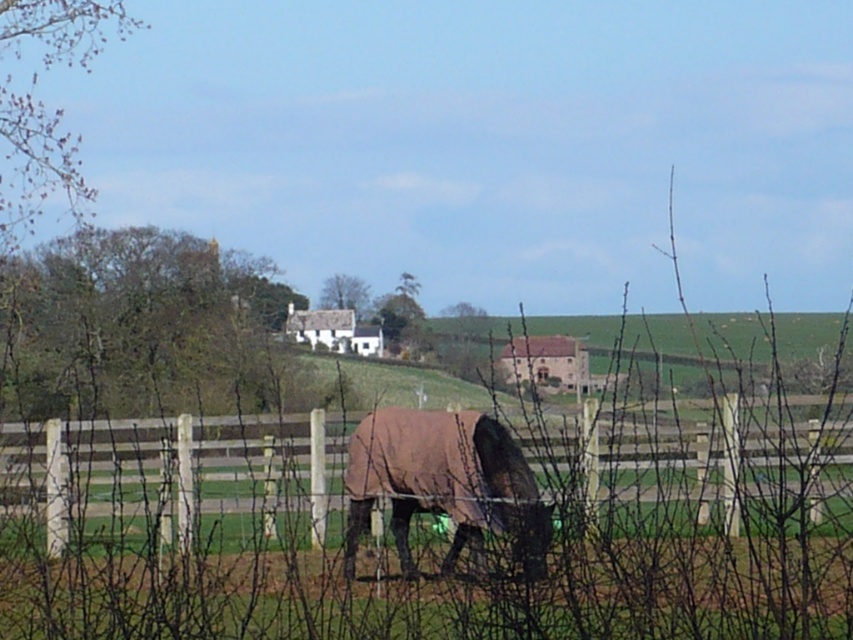
You are standing at the edge of the field looking towards the brown fuzzy horse at center. Which side of the horse do you see the brown wooden fence at lower center located?

The brown wooden fence at lower center is located to the right of the brown fuzzy horse at center from your perspective.

You are standing at the point with coordinates point [538,516] and want to move towards the point with coordinates point [292,417]. Given that the terrain between them is uneven but mostly flat, will you have to climb uphill or go downhill?

Since point [292,417] is behind point [538,516], you would be moving towards a position that is further back in the scene. In the midground, the landscape slopes upward, so moving towards point [292,417] would mean going uphill.